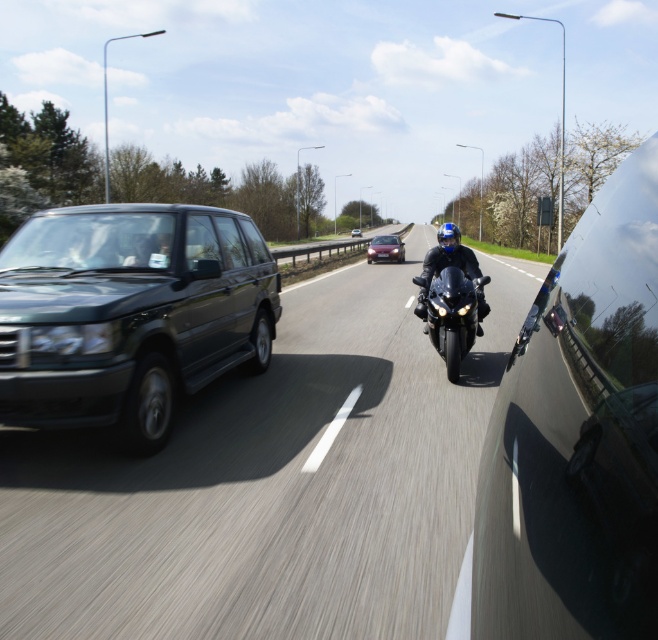
Question: Which of the following is the closest to the observer?

Choices:
 (A) black glossy suv at left
 (B) metallic red sedan at center
 (C) matte black suv at left

Answer: (A)

Question: Which point is farther to the camera?

Choices:
 (A) glossy black car at right
 (B) glossy black motorcycle at center

Answer: (B)

Question: Does black glossy suv at left appear on the left side of matte black suv at left?

Choices:
 (A) yes
 (B) no

Answer: (B)

Question: Does black glossy suv at left have a smaller size compared to glossy black motorcycle at center?

Choices:
 (A) no
 (B) yes

Answer: (A)

Question: In this image, where is glossy black motorcycle at center located relative to matte black suv at center?

Choices:
 (A) below
 (B) above

Answer: (A)

Question: Which point is farther from the camera taking this photo?

Choices:
 (A) (259, 608)
 (B) (443, 252)
 (C) (357, 232)
 (D) (649, 508)

Answer: (C)